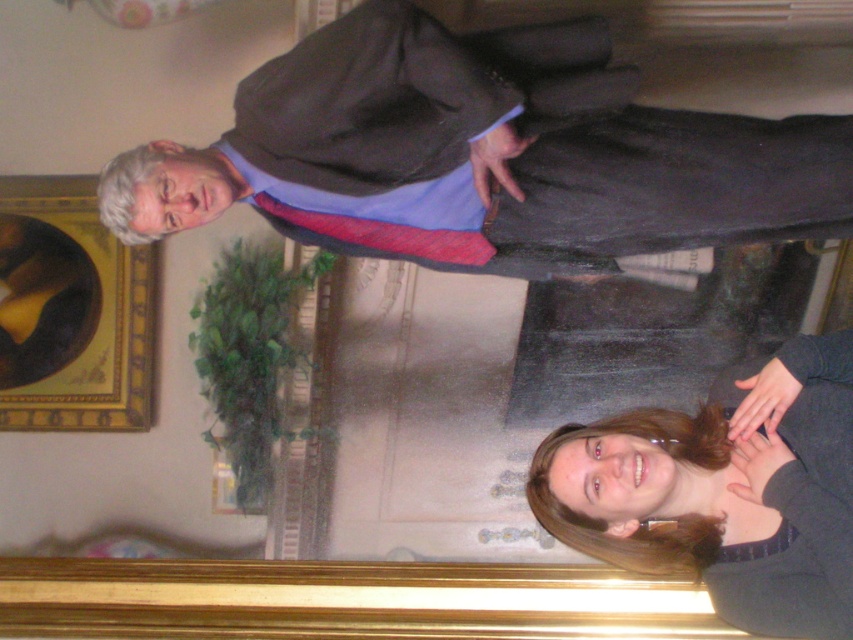
Question: Is matte black suit at upper center to the left of dark brown hair at lower right from the viewer's perspective?

Choices:
 (A) no
 (B) yes

Answer: (B)

Question: Which object is the closest to the goldwooden frame at upper left?

Choices:
 (A) matte black suit at upper center
 (B) dark brown hair at lower right

Answer: (A)

Question: Among these points, which one is nearest to the camera?

Choices:
 (A) (320, 216)
 (B) (140, 396)
 (C) (589, 467)

Answer: (C)

Question: Does dark brown hair at lower right have a larger size compared to goldwooden frame at upper left?

Choices:
 (A) no
 (B) yes

Answer: (B)

Question: Among these points, which one is farthest from the camera?

Choices:
 (A) (144, 266)
 (B) (764, 154)

Answer: (A)

Question: Is matte black suit at upper center wider than goldwooden frame at upper left?

Choices:
 (A) no
 (B) yes

Answer: (B)